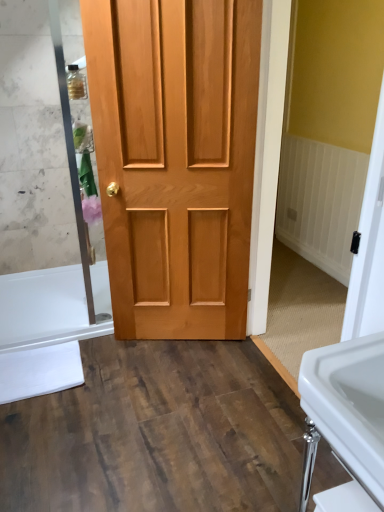
Question: Can you confirm if natural wood door at center is thinner than white glossy bathtub at lower left?

Choices:
 (A) yes
 (B) no

Answer: (A)

Question: Does natural wood door at center have a smaller size compared to white glossy bathtub at lower left?

Choices:
 (A) no
 (B) yes

Answer: (A)

Question: Is natural wood door at center bigger than white glossy bathtub at lower left?

Choices:
 (A) no
 (B) yes

Answer: (B)

Question: From the image's perspective, is natural wood door at center under white glossy bathtub at lower left?

Choices:
 (A) yes
 (B) no

Answer: (B)

Question: Is natural wood door at center outside white glossy bathtub at lower left?

Choices:
 (A) yes
 (B) no

Answer: (A)

Question: Is natural wood door at center far away from white glossy bathtub at lower left?

Choices:
 (A) no
 (B) yes

Answer: (A)

Question: Considering the relative sizes of white glossy bathtub at lower left and white glossy sink at lower right in the image provided, is white glossy bathtub at lower left bigger than white glossy sink at lower right?

Choices:
 (A) no
 (B) yes

Answer: (A)

Question: Is white glossy bathtub at lower left oriented away from white glossy sink at lower right?

Choices:
 (A) no
 (B) yes

Answer: (A)

Question: Can you confirm if white glossy bathtub at lower left is shorter than white glossy sink at lower right?

Choices:
 (A) yes
 (B) no

Answer: (A)

Question: From a real-world perspective, is white glossy bathtub at lower left over white glossy sink at lower right?

Choices:
 (A) yes
 (B) no

Answer: (B)

Question: Is white glossy bathtub at lower left to the right of white glossy sink at lower right from the viewer's perspective?

Choices:
 (A) no
 (B) yes

Answer: (A)

Question: Is white glossy bathtub at lower left located outside white glossy sink at lower right?

Choices:
 (A) yes
 (B) no

Answer: (A)

Question: Can you confirm if white glossy sink at lower right is positioned to the left of white glossy bathtub at lower left?

Choices:
 (A) yes
 (B) no

Answer: (B)